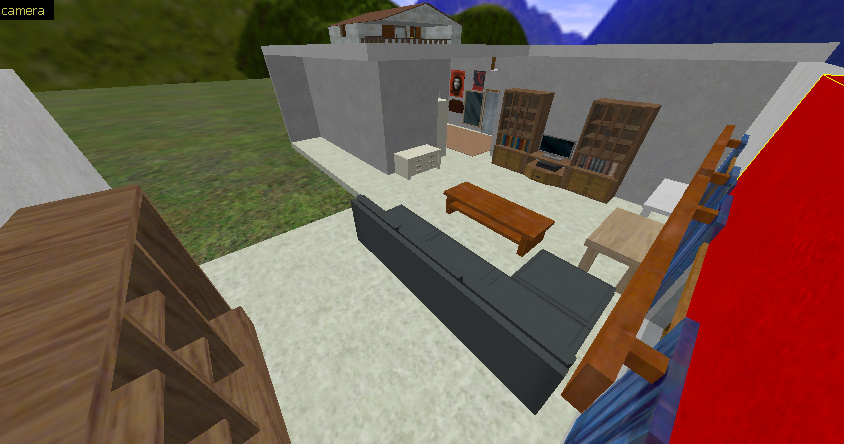
Find the location of a particular element. Image resolution: width=844 pixels, height=444 pixels. shelf is located at coordinates (606, 128).